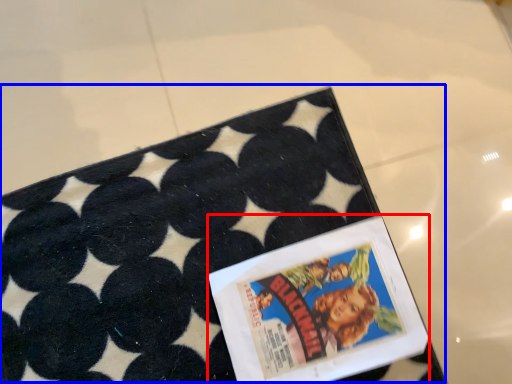
Question: Which object appears farthest to the camera in this image, comic book (highlighted by a red box) or tray (highlighted by a blue box)?

Choices:
 (A) comic book
 (B) tray

Answer: (A)